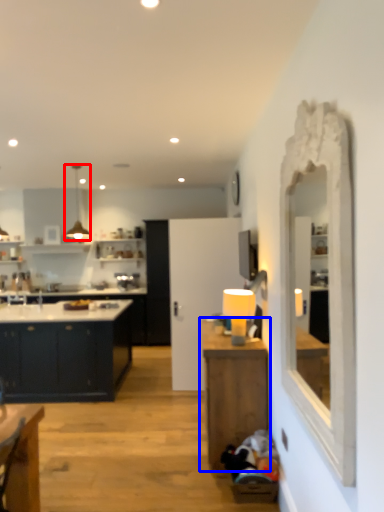
Question: Which of the following is the closest to the observer, light fixture (highlighted by a red box) or table (highlighted by a blue box)?

Choices:
 (A) light fixture
 (B) table

Answer: (B)